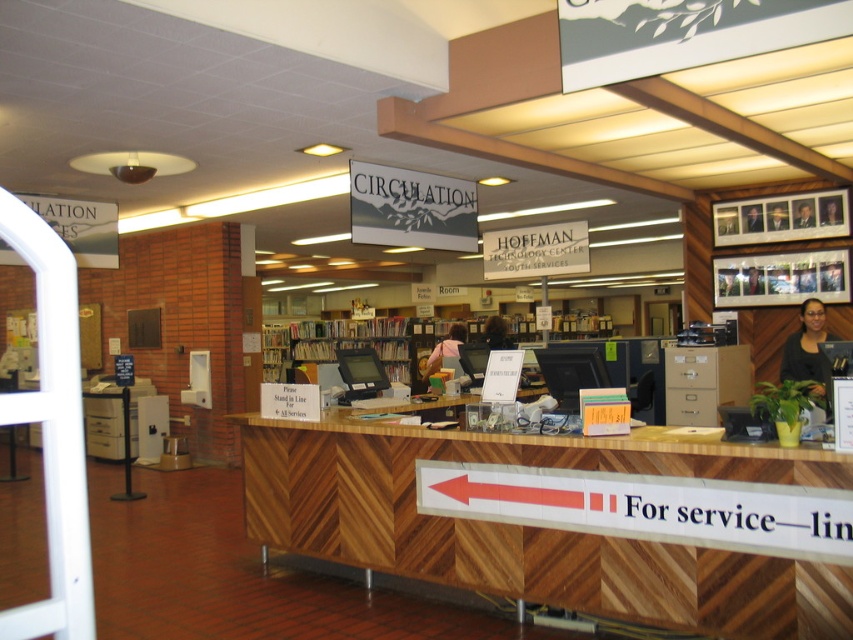
From the picture: You are a librarian and need to retrieve both the black matte shirt at right and the matte pink shirt at center. Which one should you pick up first to follow the proper service line order?

The black matte shirt at right is closer to the viewer than the matte pink shirt at center, so you should pick up the black matte shirt at right first to follow the proper service line order.

You are a library patron standing in front of the circulation desk. You notice the black matte shirt at right and the matte black hair at center. Which object is positioned lower in the image?

The black matte shirt at right is positioned lower than the matte black hair at center in the image.